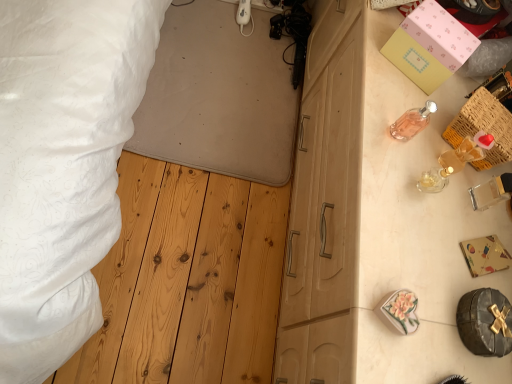
This screenshot has height=384, width=512. In order to click on free spot to the right of pink glass perfume at upper right in this screenshot , I will do `click(442, 173)`.